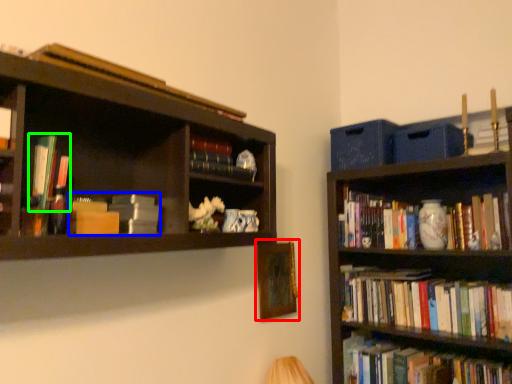
Question: Based on their relative distances, which object is nearer to picture frame (highlighted by a red box)? Choose from book (highlighted by a blue box) and book (highlighted by a green box).

Choices:
 (A) book
 (B) book

Answer: (A)